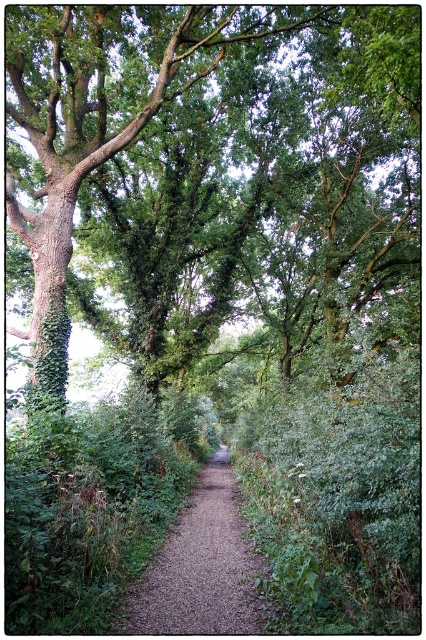
Question: Does green rough bark tree at upper center appear under brown gravel path at center?

Choices:
 (A) yes
 (B) no

Answer: (B)

Question: Considering the relative positions of green rough bark tree at upper center and brown gravel path at center in the image provided, where is green rough bark tree at upper center located with respect to brown gravel path at center?

Choices:
 (A) below
 (B) above

Answer: (B)

Question: Which object is closer to the camera taking this photo?

Choices:
 (A) brown gravel path at center
 (B) green rough bark tree at upper center

Answer: (A)

Question: In this image, where is green rough bark tree at upper center located relative to brown gravel path at center?

Choices:
 (A) above
 (B) below

Answer: (A)

Question: Among these points, which one is nearest to the camera?

Choices:
 (A) (149, 600)
 (B) (147, 150)

Answer: (A)